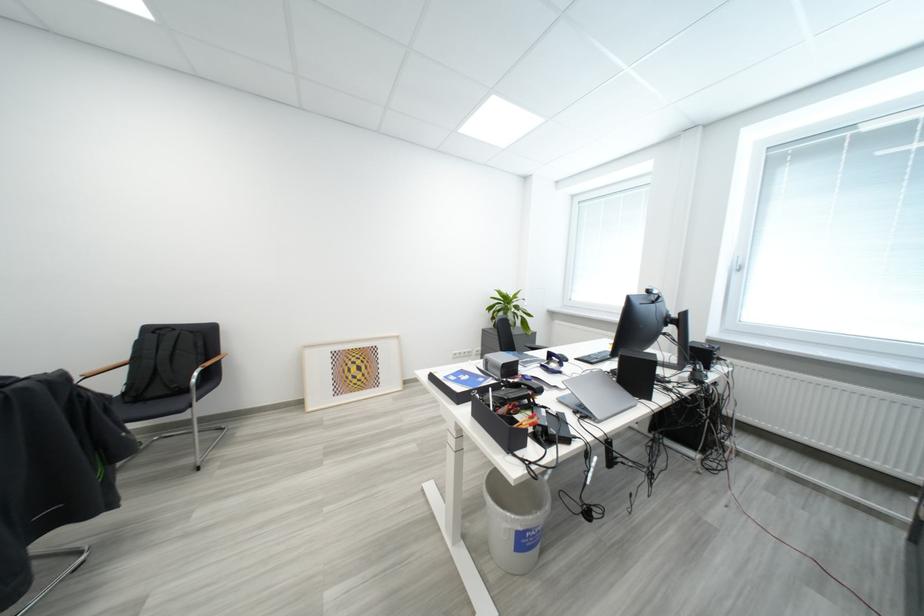
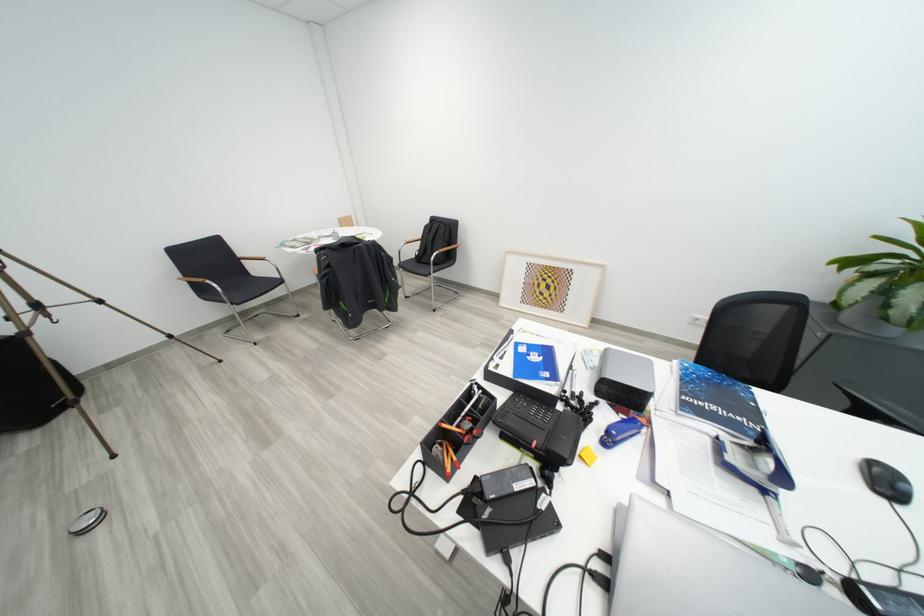
Locate, in the second image, the point that corresponds to point (205, 377) in the first image.

(444, 257)